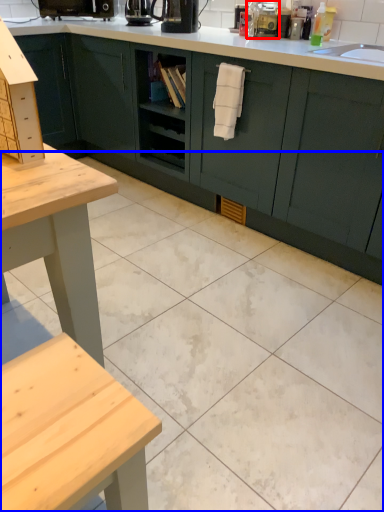
Question: Which of the following is the farthest to the observer, appliance (highlighted by a red box) or ceramic tile (highlighted by a blue box)?

Choices:
 (A) appliance
 (B) ceramic tile

Answer: (A)